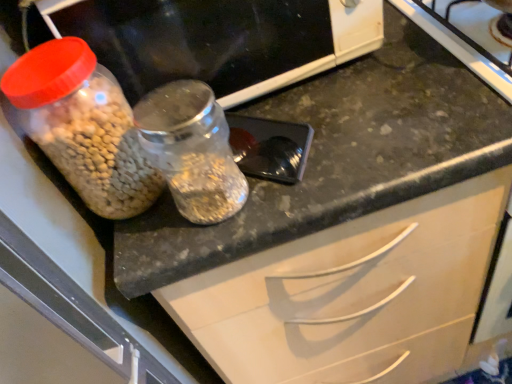
Identify the location of free space to the right of transparent glass jar at center. (339, 147).